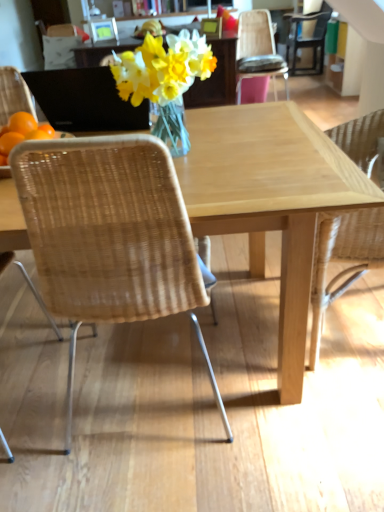
Locate an element on the screen. The image size is (384, 512). vacant area that lies between natural wood table at center and woven wood chair at left, which is counted as the fourth chair, starting from the top is located at coordinates (158, 449).